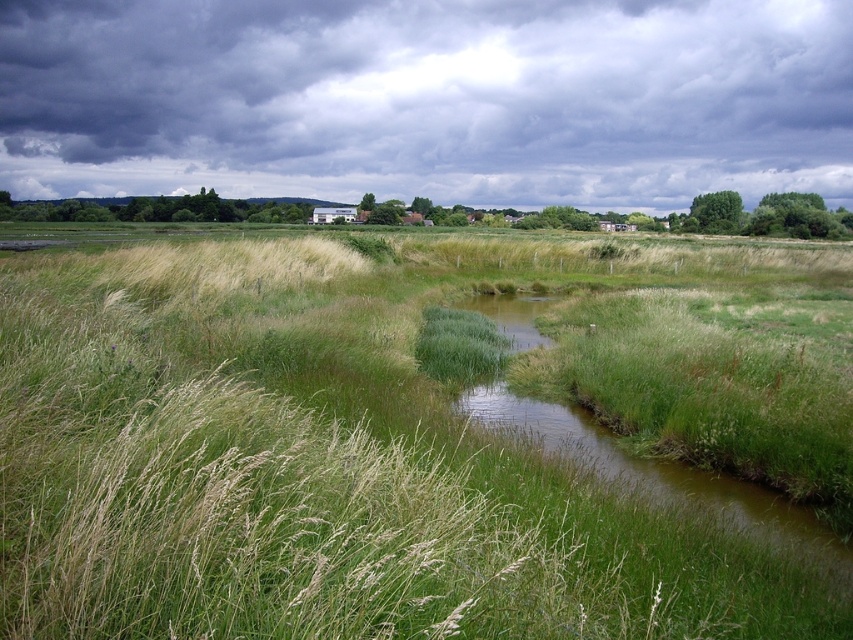
Can you confirm if green grassy at center is positioned above dark gray cloud at upper center?

Actually, green grassy at center is below dark gray cloud at upper center.

Does point (245, 282) come in front of point (392, 160)?

Yes, it is.

The height and width of the screenshot is (640, 853). In order to click on green grassy at center in this screenshot , I will do `click(314, 474)`.

You are a GUI agent. You are given a task and a screenshot of the screen. Output one action in this format:
    pyautogui.click(x=<x>, y=<y>)
    Task: Click on the green grassy at center
    Image resolution: width=853 pixels, height=640 pixels.
    Given the screenshot: What is the action you would take?
    pyautogui.click(x=314, y=474)